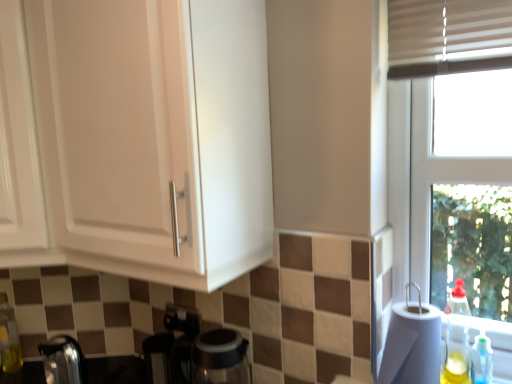
Question: Should I look upward or downward to see satin chrome faucet at lower left?

Choices:
 (A) up
 (B) down

Answer: (B)

Question: Considering the relative sizes of translucent plastic soap dispenser at lower right, arranged as the 1th bottle when viewed from the right, and white paper towel at right in the image provided, is translucent plastic soap dispenser at lower right, arranged as the 1th bottle when viewed from the right, thinner than white paper towel at right?

Choices:
 (A) no
 (B) yes

Answer: (B)

Question: Is translucent plastic soap dispenser at lower right, the 3th bottle positioned from the left, facing away from white paper towel at right?

Choices:
 (A) yes
 (B) no

Answer: (B)

Question: Is translucent plastic soap dispenser at lower right, which appears as the 1th bottle when viewed from the front, with white paper towel at right?

Choices:
 (A) yes
 (B) no

Answer: (B)

Question: Does translucent plastic soap dispenser at lower right, arranged as the third bottle when viewed from the back, have a smaller size compared to white paper towel at right?

Choices:
 (A) no
 (B) yes

Answer: (B)

Question: Does translucent plastic soap dispenser at lower right, arranged as the third bottle when viewed from the back, lie in front of white paper towel at right?

Choices:
 (A) yes
 (B) no

Answer: (B)

Question: Does translucent plastic soap dispenser at lower right, arranged as the 1th bottle when viewed from the right, appear on the right side of white paper towel at right?

Choices:
 (A) no
 (B) yes

Answer: (B)

Question: Can you confirm if translucent plastic bottle at right, which is the second bottle from right to left, is wider than white matte cabinet at upper left, marked as the 2th cabinetry in a left-to-right arrangement?

Choices:
 (A) yes
 (B) no

Answer: (B)

Question: Is there a large distance between translucent plastic bottle at right, which is the second bottle from right to left, and white matte cabinet at upper left, marked as the 2th cabinetry in a left-to-right arrangement?

Choices:
 (A) no
 (B) yes

Answer: (B)

Question: Is white matte cabinet at upper left, the first cabinetry in the right-to-left sequence, a part of translucent plastic bottle at right, which is the second bottle from front to back?

Choices:
 (A) no
 (B) yes

Answer: (A)

Question: Does translucent plastic bottle at right, arranged as the 2th bottle when viewed from the left, have a greater height compared to white matte cabinet at upper left, marked as the 2th cabinetry in a left-to-right arrangement?

Choices:
 (A) no
 (B) yes

Answer: (A)

Question: Does translucent plastic bottle at right, arranged as the 2th bottle when viewed from the left, lie behind white matte cabinet at upper left, marked as the 2th cabinetry in a left-to-right arrangement?

Choices:
 (A) yes
 (B) no

Answer: (A)

Question: Can you confirm if translucent plastic bottle at right, arranged as the 2th bottle when viewed from the left, is smaller than white matte cabinet at upper left, marked as the 2th cabinetry in a left-to-right arrangement?

Choices:
 (A) yes
 (B) no

Answer: (A)

Question: Is white paper towel at right behind translucent plastic soap dispenser at lower right, arranged as the third bottle when viewed from the back?

Choices:
 (A) no
 (B) yes

Answer: (A)